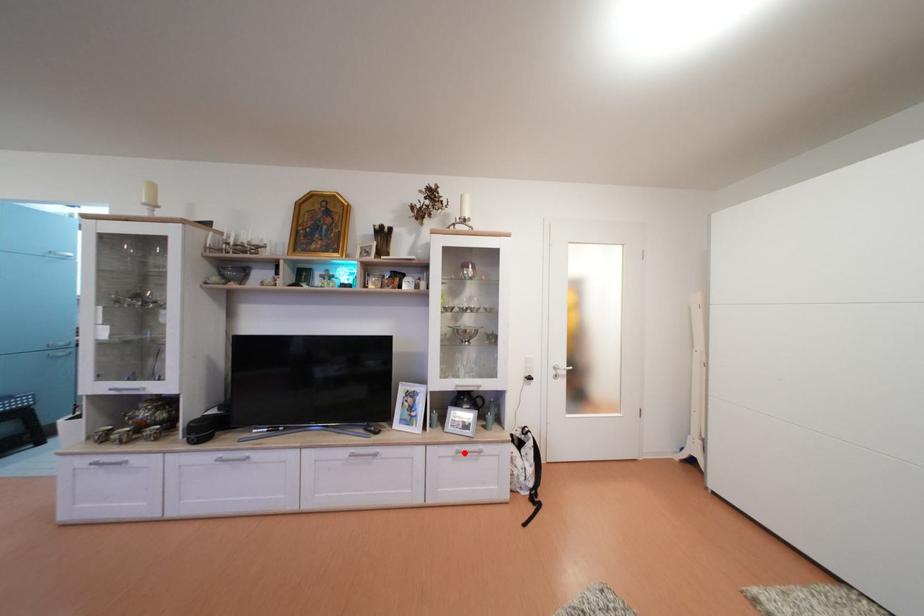
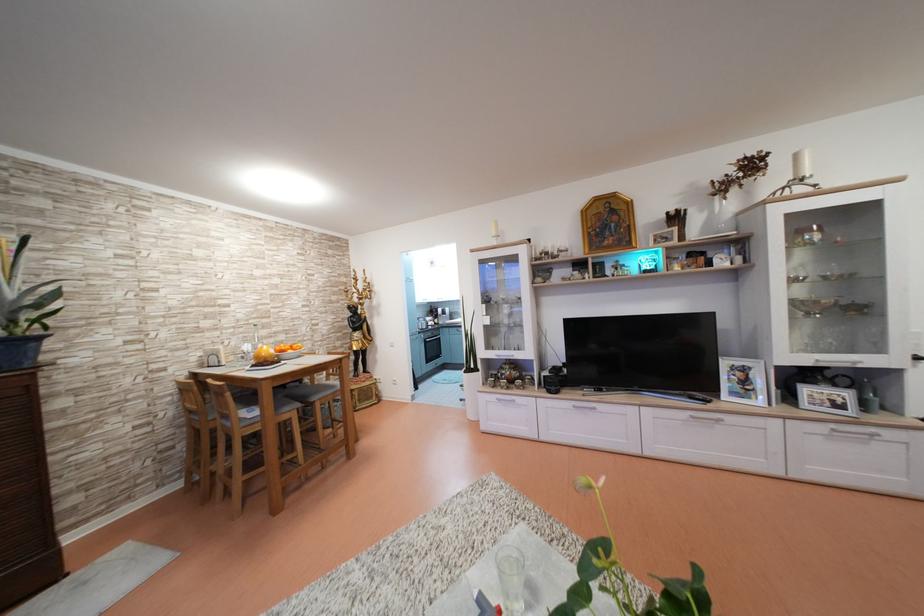
Question: A red point is marked in image1. In image2, is the corresponding 3D point closer to the camera or farther? Reply with the corresponding letter.

Choices:
 (A) The corresponding 3D point is closer.
 (B) The corresponding 3D point is farther.

Answer: (A)